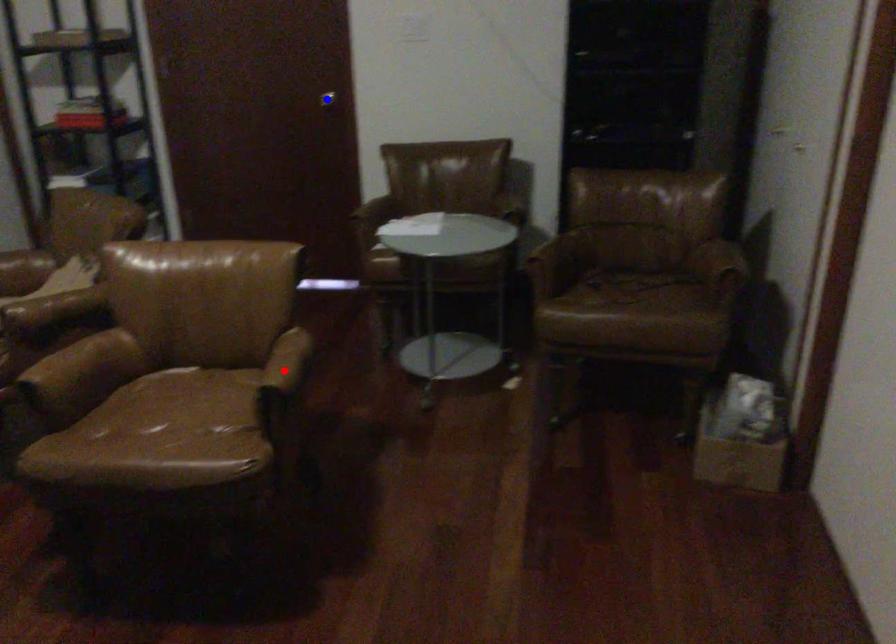
Question: In the image, two points are highlighted. Which point is nearer to the camera? Reply with the corresponding letter.

Choices:
 (A) blue point
 (B) red point

Answer: (B)